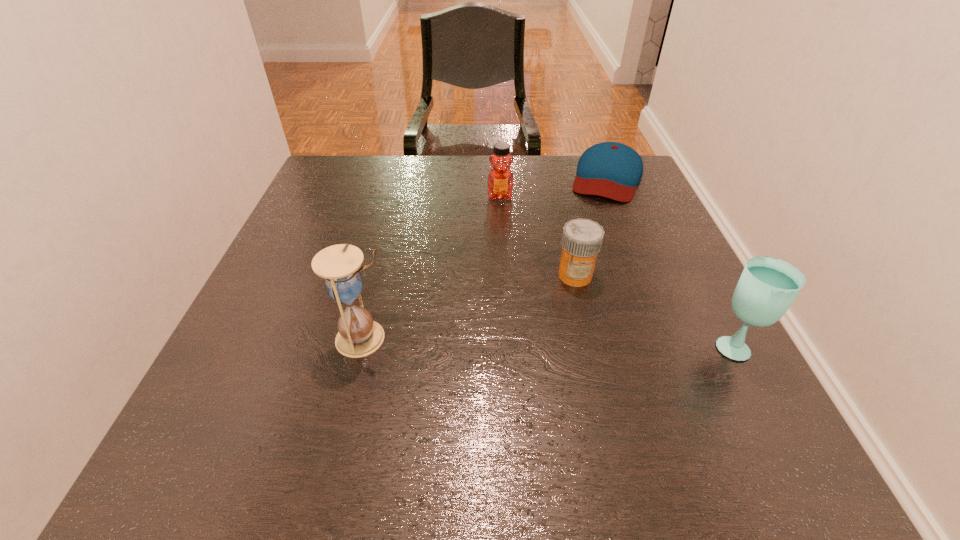
Where is `unoccupied position between the shortest object and the leftmost object`? unoccupied position between the shortest object and the leftmost object is located at coordinates (486, 258).

This screenshot has height=540, width=960. In order to click on vacant point located between the hourglass and the third object from right to left in this screenshot , I will do `click(470, 307)`.

This screenshot has height=540, width=960. In order to click on free space between the glass and the leftmost object in this screenshot , I will do `click(549, 341)`.

The image size is (960, 540). I want to click on vacant region between the glass and the tallest object, so click(x=549, y=341).

At what (x,y) coordinates should I click in order to perform the action: click on vacant space that is in between the second tallest object and the honey. Please return your answer as a coordinate pair (x, y). Looking at the image, I should click on (616, 271).

Identify the location of free spot between the hourglass and the third object from left to right. This screenshot has height=540, width=960. (470, 307).

At what (x,y) coordinates should I click in order to perform the action: click on vacant space that's between the third shortest object and the baseball cap. Please return your answer as a coordinate pair (x, y). The image size is (960, 540). Looking at the image, I should click on (554, 187).

Locate an element on the screen. The height and width of the screenshot is (540, 960). vacant area between the shortest object and the second object from left to right is located at coordinates (554, 187).

Locate an element on the screen. Image resolution: width=960 pixels, height=540 pixels. vacant area that lies between the honey and the baseball cap is located at coordinates (554, 187).

You are a GUI agent. You are given a task and a screenshot of the screen. Output one action in this format:
    pyautogui.click(x=<x>, y=<y>)
    Task: Click on the object that stands as the second closest to the shortest object
    The image size is (960, 540).
    Given the screenshot: What is the action you would take?
    pyautogui.click(x=582, y=239)